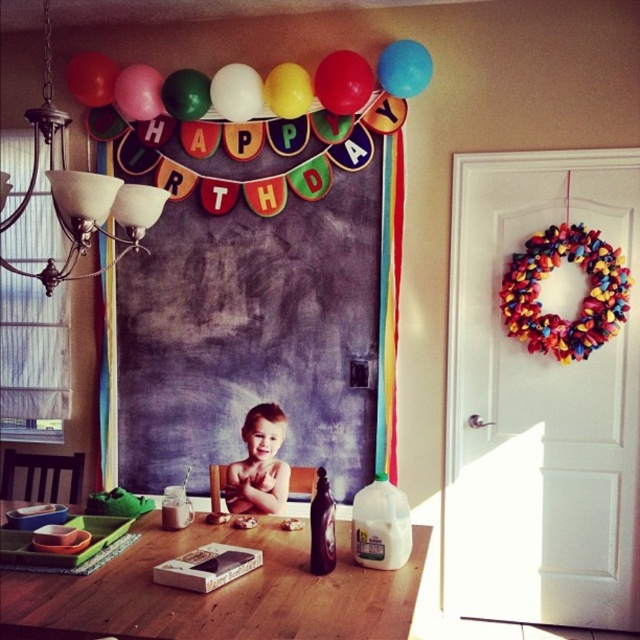
Question: Which object is farther from the camera taking this photo?

Choices:
 (A) wooden table at center
 (B) smooth skin baby at center
 (C) green glossy balloon at upper center

Answer: (C)

Question: Which of the following is the farthest from the observer?

Choices:
 (A) (227, 112)
 (B) (88, 81)
 (C) (188, 104)

Answer: (B)

Question: Is colorful paper banner at upper center smaller than smooth skin baby at center?

Choices:
 (A) no
 (B) yes

Answer: (A)

Question: From the image, what is the correct spatial relationship of white matte balloon at upper center in relation to pink matte balloon at upper center?

Choices:
 (A) right
 (B) left

Answer: (A)

Question: Which point is closer to the camera taking this photo?

Choices:
 (A) (248, 484)
 (B) (244, 92)
 (C) (131, 84)

Answer: (A)

Question: Is colorful paper banner at upper center closer to camera compared to blue matte balloon at upper center?

Choices:
 (A) yes
 (B) no

Answer: (B)